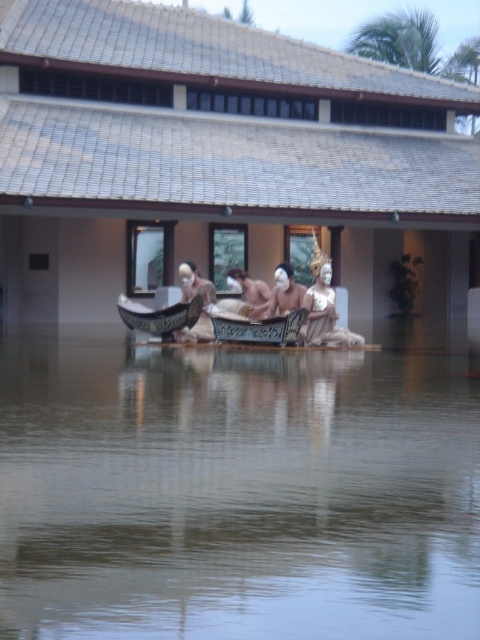
Question: Is matte white statue at center bigger than dark brown polished wood boat at center?

Choices:
 (A) no
 (B) yes

Answer: (B)

Question: Which of the following is the farthest from the observer?

Choices:
 (A) matte white statue at center
 (B) matte white mask at center
 (C) dark brown polished wood boat at center

Answer: (A)

Question: Which object is the farthest from the matte white statue at center?

Choices:
 (A) smooth wooden boat at center
 (B) dark brown polished wood boat at center

Answer: (A)

Question: Is the position of matte white mask at center less distant than that of smooth wooden boat at center?

Choices:
 (A) no
 (B) yes

Answer: (B)

Question: In this image, where is matte white statue at center located relative to matte white mask at center?

Choices:
 (A) below
 (B) above

Answer: (A)

Question: Among these objects, which one is nearest to the camera?

Choices:
 (A) dark brown polished wood boat at center
 (B) clear water at center
 (C) shiny dark wood boat at center

Answer: (B)